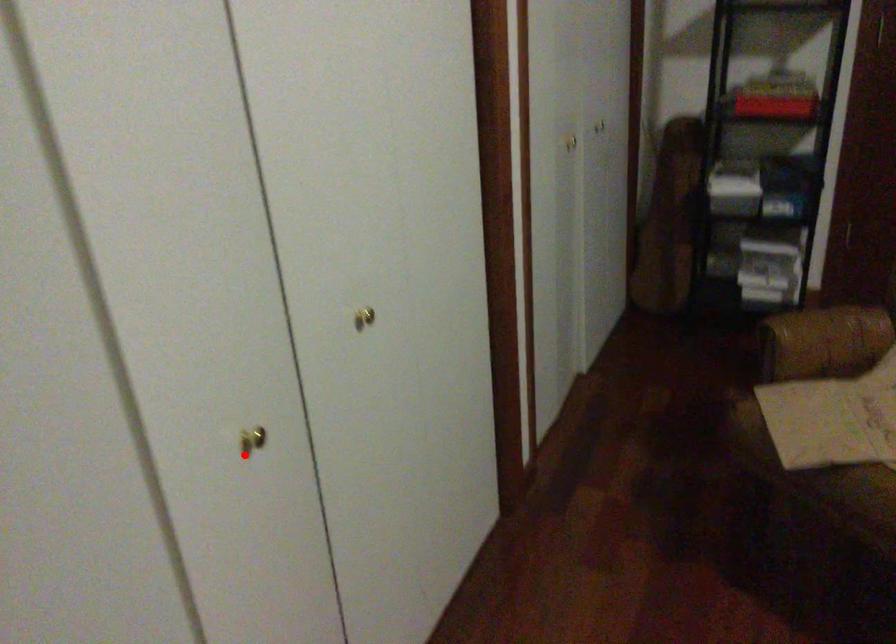
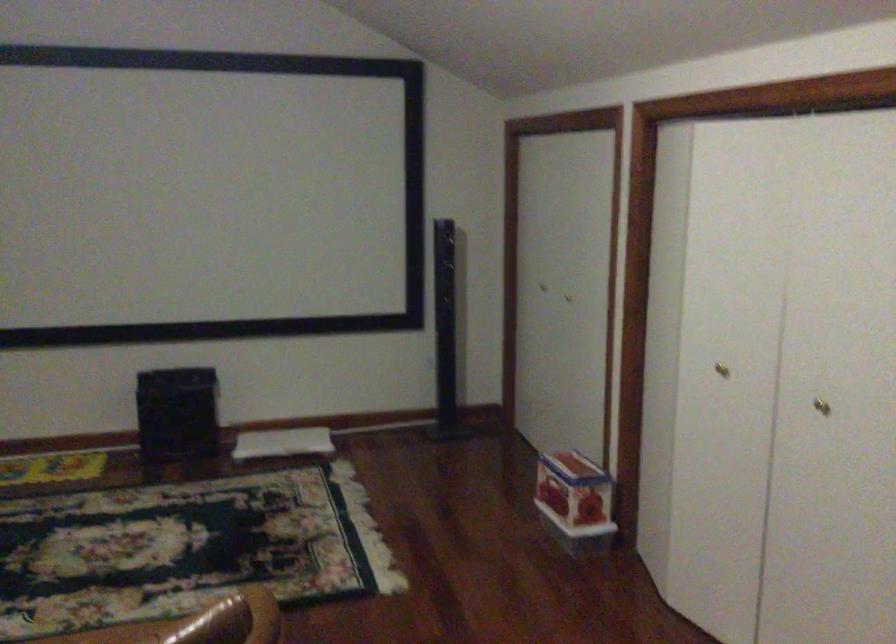
Question: A red point is marked in image1. In image2, is the corresponding 3D point closer to the camera or farther? Reply with the corresponding letter.

Choices:
 (A) The corresponding 3D point is closer.
 (B) The corresponding 3D point is farther.

Answer: (B)